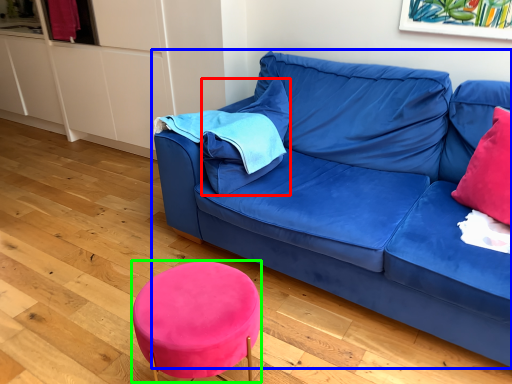
Question: Which object is the closest to the pillow (highlighted by a red box)? Choose among these: studio couch (highlighted by a blue box) or bar stool (highlighted by a green box).

Choices:
 (A) studio couch
 (B) bar stool

Answer: (A)